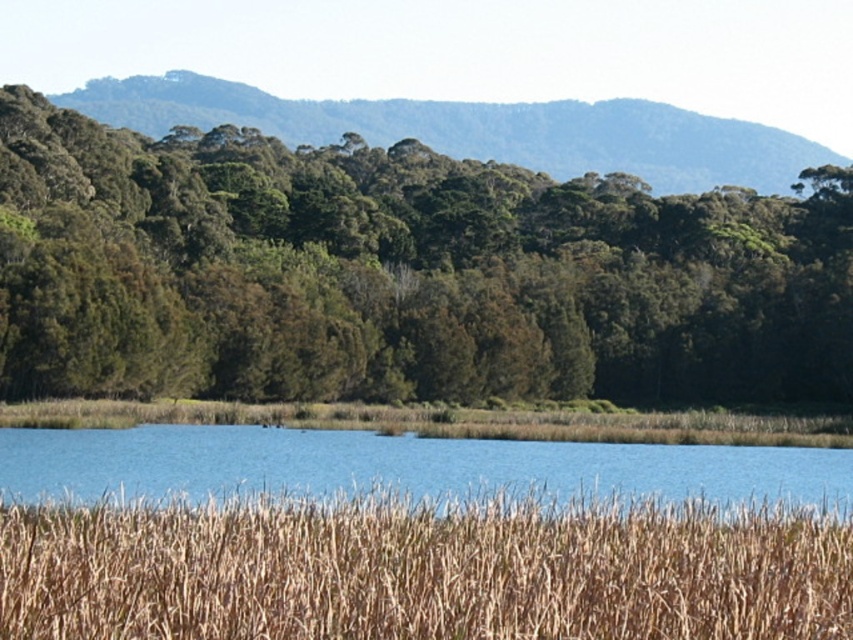
You are standing in the serene natural landscape and want to place a small marker at both point (671, 380) and point (515, 508). Based on their positions, which point is closer to you?

Point (671, 380) is further to the viewer than point (515, 508), so point (515, 508) is closer to you.

You are a photographer trying to capture the green leafy trees at center and the dry grass at lower center in a single shot. Based on their sizes in the image, which one would appear more prominent in the photo?

The green leafy trees at center would appear more prominent in the photo because they are bigger than the dry grass at lower center.